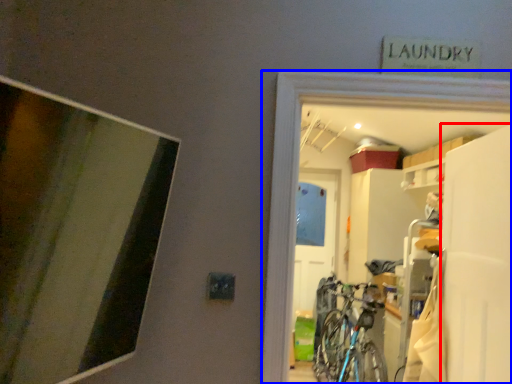
Question: Which of the following is the closest to the observer, screen door (highlighted by a red box) or garage (highlighted by a blue box)?

Choices:
 (A) screen door
 (B) garage

Answer: (B)